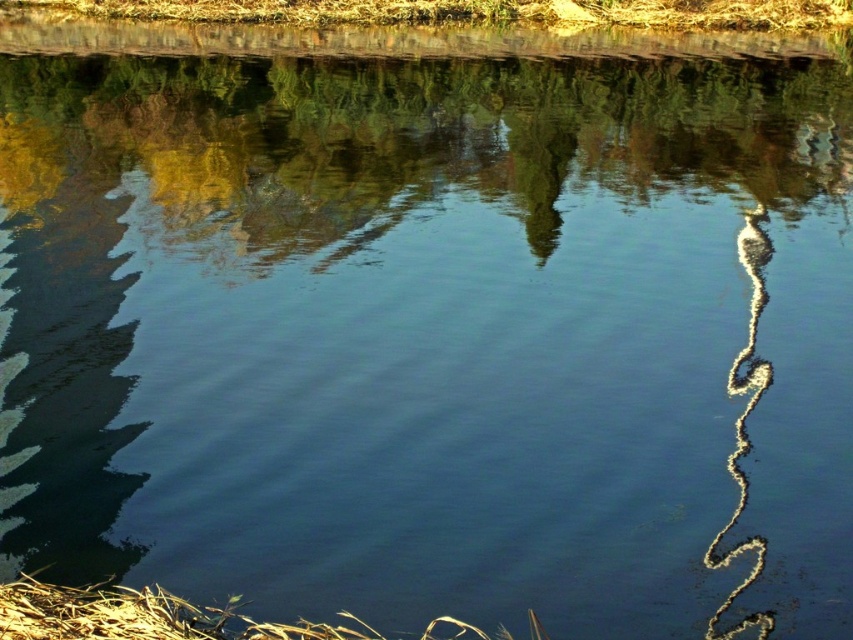
Is smooth water at center smaller than brown grass at lower left?

No.

How far apart are smooth water at center and brown grass at lower left?

A distance of 18.68 meters exists between smooth water at center and brown grass at lower left.

Between point (521, 58) and point (55, 600), which one is positioned in front?

Point (55, 600) is in front.

Find the location of `smooth water at center`. smooth water at center is located at coordinates (415, 138).